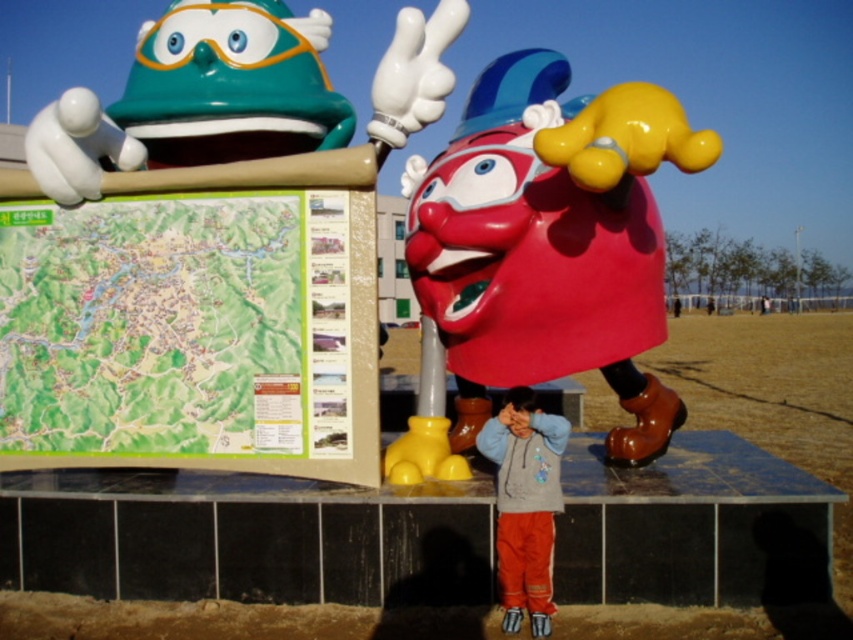
You are standing at the point with coordinates point (83,339) and want to walk towards the point with coordinates point (529,256). Which direction should you face to walk directly towards your destination?

You should face north because point (529,256) is in front of point (83,339), indicating it is north of your current position.

Based on the photo, you are a tourist who wants to wear the shiny plastic helmet at upper left and also carry the green paper map at upper left. Since both items are at the upper left, which one should you pick up first to avoid covering the other?

The shiny plastic helmet at upper left is bigger than the green paper map at upper left, so you should pick up the shiny plastic helmet at upper left first to avoid covering the green paper map at upper left when placing it on your head.

You are a visitor standing in front of the two sculptures. You want to touch the shiny plastic clown at center but need to avoid the shiny plastic helmet at upper left. Which object should you move closer to first?

You should move closer to the shiny plastic clown at center first because the shiny plastic helmet at upper left is further away from you, so you can avoid it by approaching the clown directly.